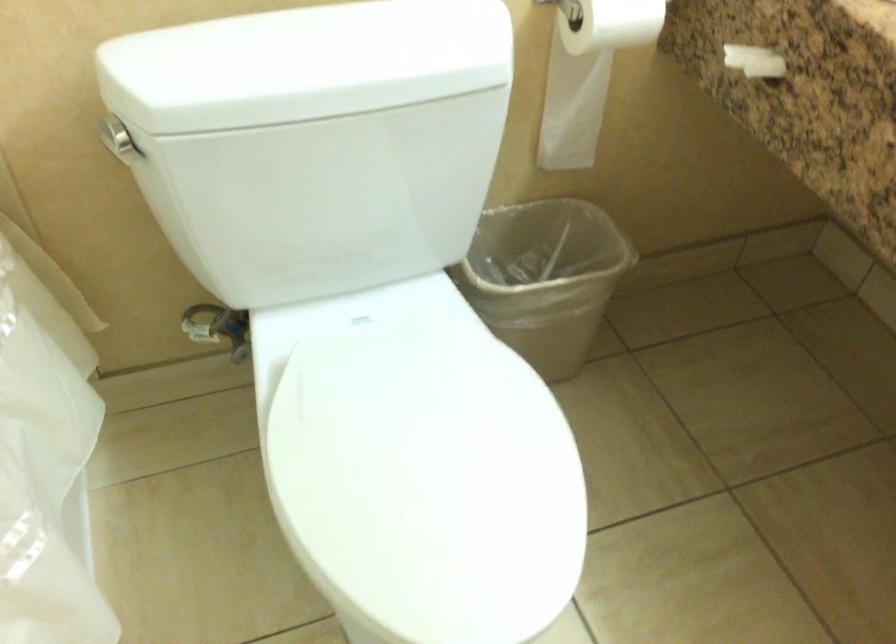
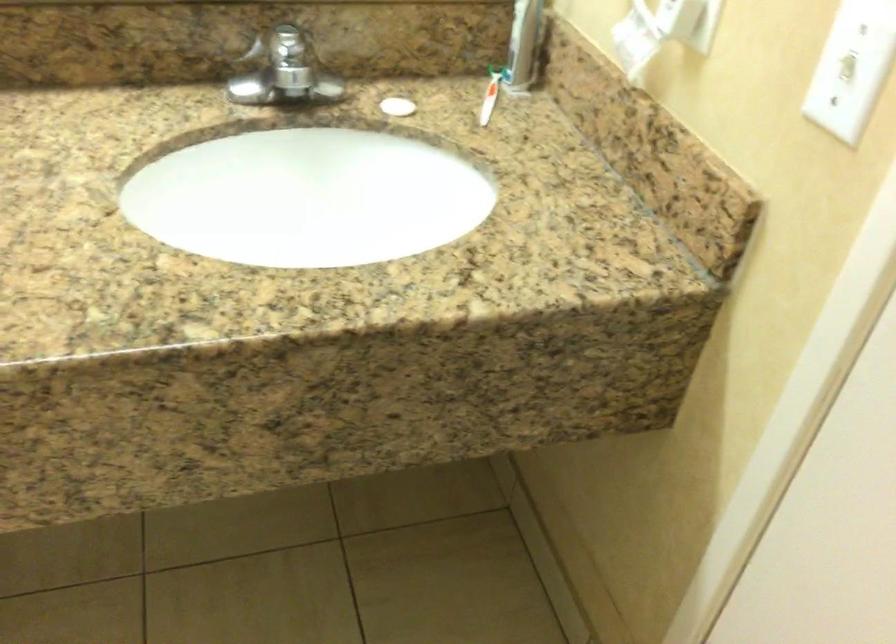
How did the camera likely rotate?

The camera rotated toward right-down.